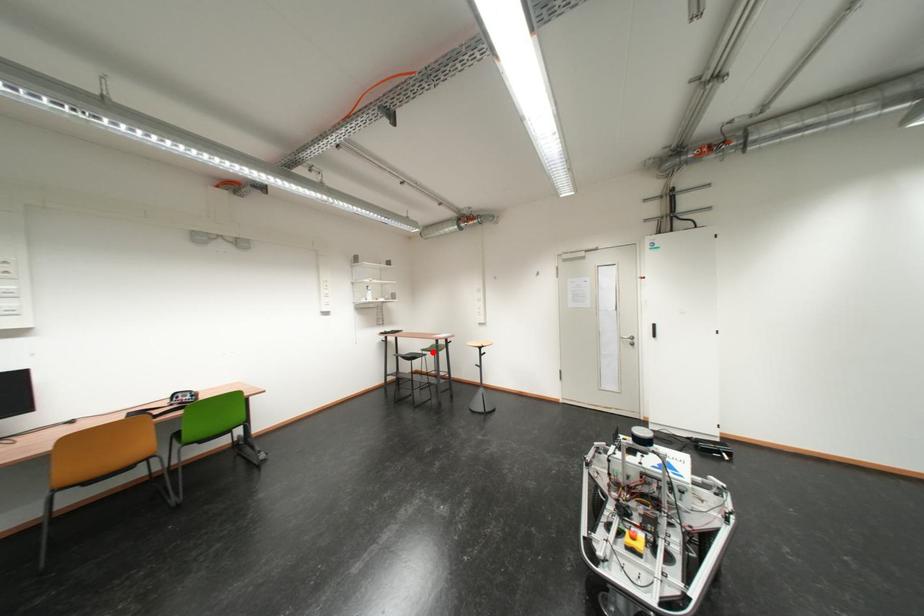
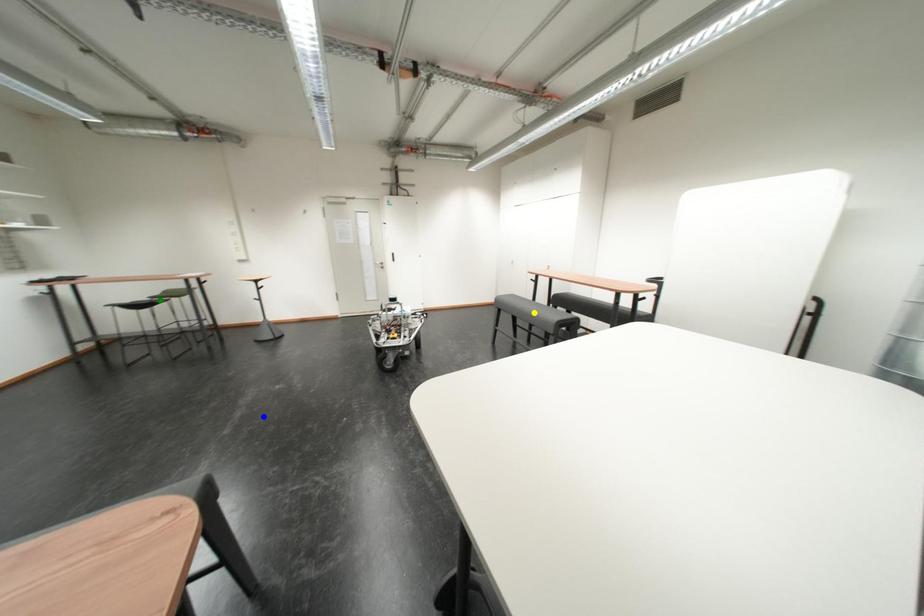
Question: I am providing you with two images of the same scene from different viewpoints. A red point is marked on the first image. You are given multiple points on the second image. Which mark in image 2 goes with the point in image 1?

Choices:
 (A) yellow point
 (B) green point
 (C) blue point

Answer: (B)